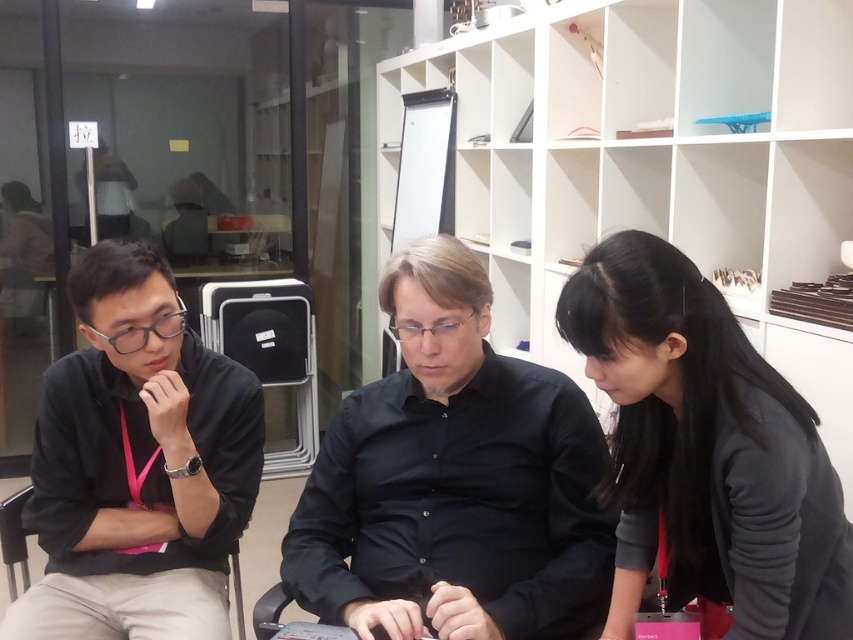
You are an interior designer observing this office scene. You notice the black matte hair at lower right and the black matte shirt at left. Which object occupies a larger area in the image?

The black matte shirt at left occupies a larger area in the image compared to the black matte hair at lower right, as the description states the hair is smaller in size than the shirt.

You are a photographer trying to capture a closeup of the person closest to the camera in the scene. Which of the two points, point (114, 461) or point (26, 563), should you focus on to ensure the subject is in focus?

Point (114, 461) is closer to the camera than point (26, 563), so focusing on point (114, 461) will ensure the subject is in focus.

You are a delivery robot that is 20 inches wide. You need to move from the entrance to the conference table in the center of the room. There is a path between the black matte hair at lower right and the black matte shirt at left. Can you fit through that path?

The distance between the black matte hair at lower right and the black matte shirt at left is 39.14 inches. Since the robot is 20 inches wide, it can fit through the path as the space is wider than the robot.